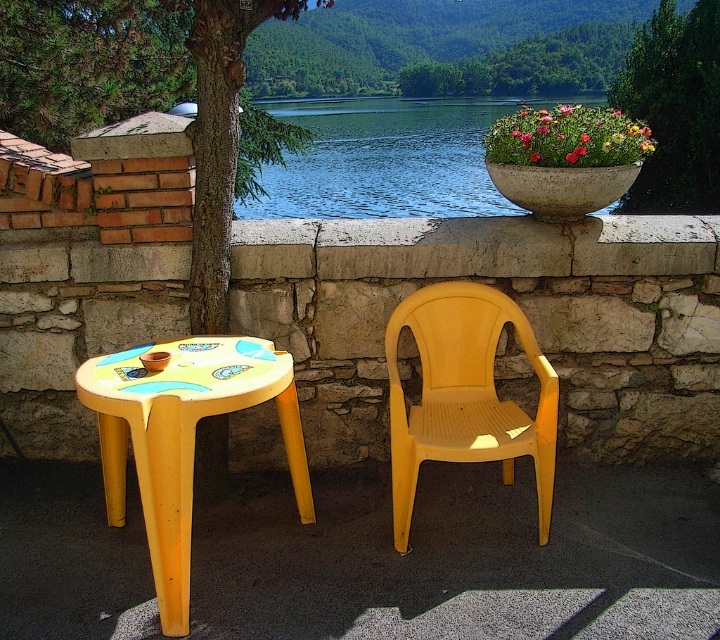
Question: Which point is closer to the camera taking this photo?

Choices:
 (A) pyautogui.click(x=701, y=76)
 (B) pyautogui.click(x=402, y=179)

Answer: (A)

Question: Which point is closer to the camera taking this photo?

Choices:
 (A) (688, 86)
 (B) (498, 422)
 (C) (400, 164)
 (D) (0, 32)

Answer: (B)

Question: Is yellow plastic chair at center thinner than green leafy tree at upper center?

Choices:
 (A) yes
 (B) no

Answer: (A)

Question: Considering the real-world distances, which object is farthest from the blue water at upper center?

Choices:
 (A) green rough bark tree at upper left
 (B) green leafy tree at upper center
 (C) yellow plastic table at lower left

Answer: (C)

Question: Can you confirm if green rough bark tree at upper left is wider than yellow plastic chair at center?

Choices:
 (A) yes
 (B) no

Answer: (A)

Question: In this image, where is green rough bark tree at upper left located relative to yellow plastic table at lower left?

Choices:
 (A) above
 (B) below

Answer: (A)